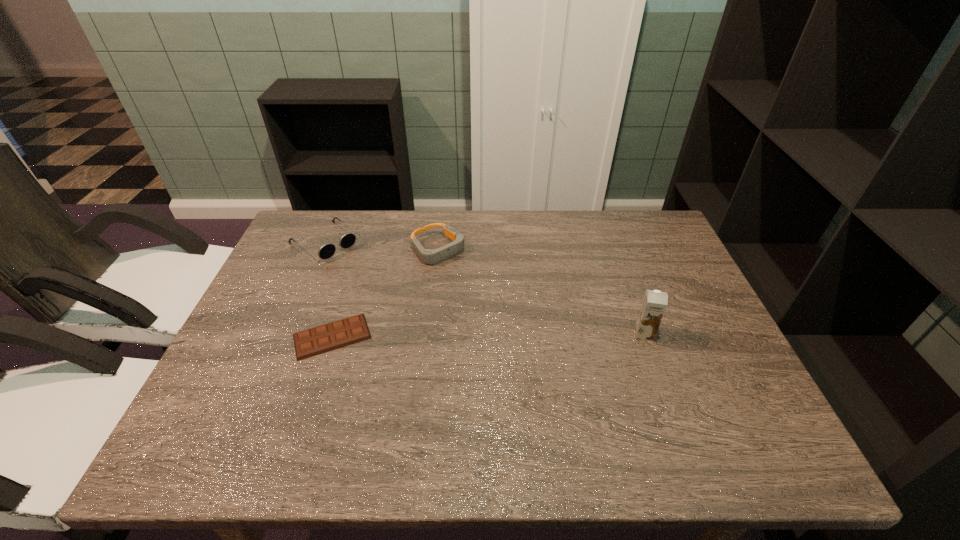
Identify the location of free spot between the chocolate bar and the goggles. The image size is (960, 540). (385, 293).

Where is `free space that is in between the rightmost object and the sunglasses`? free space that is in between the rightmost object and the sunglasses is located at coordinates (484, 288).

The height and width of the screenshot is (540, 960). Identify the location of free space that is in between the tallest object and the third object from left to right. (540, 292).

Where is `empty space that is in between the sunglasses and the shortest object`? This screenshot has width=960, height=540. empty space that is in between the sunglasses and the shortest object is located at coordinates (328, 289).

Identify which object is located as the third nearest to the sunglasses. Please provide its 2D coordinates. Your answer should be formatted as a tuple, i.e. [(x, y)], where the tuple contains the x and y coordinates of a point satisfying the conditions above.

[(654, 304)]

Where is `object that is the closest to the shortest object`? The height and width of the screenshot is (540, 960). object that is the closest to the shortest object is located at coordinates (327, 250).

Where is `free location that satisfies the following two spatial constraints: 1. on the front side of the tallest object; 2. on the right side of the sunglasses`? The width and height of the screenshot is (960, 540). free location that satisfies the following two spatial constraints: 1. on the front side of the tallest object; 2. on the right side of the sunglasses is located at coordinates (286, 334).

The height and width of the screenshot is (540, 960). Find the location of `vacant region that satisfies the following two spatial constraints: 1. on the back side of the chocolate bar; 2. on the right side of the goggles`. vacant region that satisfies the following two spatial constraints: 1. on the back side of the chocolate bar; 2. on the right side of the goggles is located at coordinates (361, 249).

Where is `vacant space that satisfies the following two spatial constraints: 1. on the front side of the chocolate bar; 2. on the left side of the sunglasses`? vacant space that satisfies the following two spatial constraints: 1. on the front side of the chocolate bar; 2. on the left side of the sunglasses is located at coordinates (285, 336).